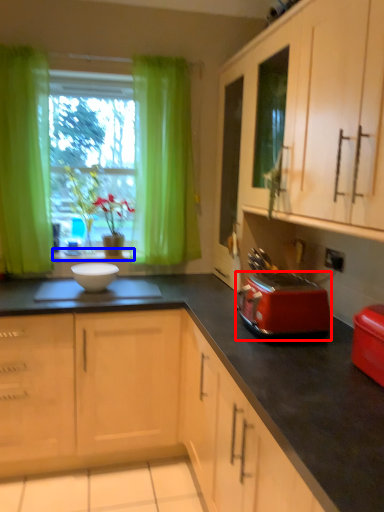
Question: Which of the following is the farthest to the observer, kitchen appliance (highlighted by a red box) or window sill (highlighted by a blue box)?

Choices:
 (A) kitchen appliance
 (B) window sill

Answer: (B)